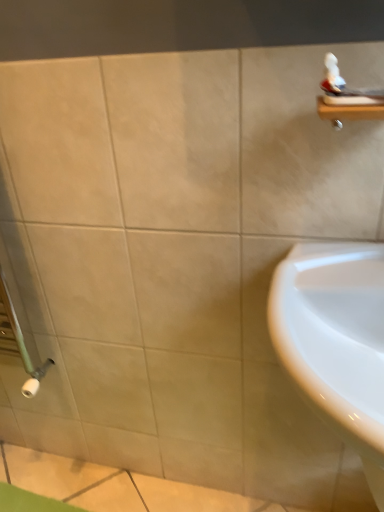
Describe the element at coordinates (348, 112) in the screenshot. The image size is (384, 512). I see `wooden shelf at upper right` at that location.

Identify the location of wooden shelf at upper right. This screenshot has height=512, width=384. (348, 112).

The height and width of the screenshot is (512, 384). Describe the element at coordinates (336, 338) in the screenshot. I see `white glossy sink at lower right` at that location.

What is the approximate width of white glossy sink at lower right?

The width of white glossy sink at lower right is 19.23 inches.

What is the approximate height of white glossy sink at lower right?

white glossy sink at lower right is 19.96 inches tall.

This screenshot has height=512, width=384. Find the location of `white glossy sink at lower right`. white glossy sink at lower right is located at coordinates (336, 338).

The image size is (384, 512). Identify the location of wooden shelf at upper right. (348, 112).

Can you confirm if white glossy sink at lower right is positioned to the left of wooden shelf at upper right?

Yes.

Which is behind, white glossy sink at lower right or wooden shelf at upper right?

Positioned behind is wooden shelf at upper right.

Does point (369, 476) appear closer or farther from the camera than point (333, 114)?

Clearly, point (369, 476) is closer to the camera than point (333, 114).

From the image's perspective, does white glossy sink at lower right appear higher than wooden shelf at upper right?

No, from the image's perspective, white glossy sink at lower right is not above wooden shelf at upper right.

From a real-world perspective, between white glossy sink at lower right and wooden shelf at upper right, who is vertically lower?

From a 3D spatial view, white glossy sink at lower right is below.

Between white glossy sink at lower right and wooden shelf at upper right, which one has larger width?

white glossy sink at lower right.

Considering the sizes of objects white glossy sink at lower right and wooden shelf at upper right in the image provided, who is shorter, white glossy sink at lower right or wooden shelf at upper right?

wooden shelf at upper right.

In the scene shown: Considering the sizes of objects white glossy sink at lower right and wooden shelf at upper right in the image provided, who is bigger, white glossy sink at lower right or wooden shelf at upper right?

Bigger between the two is white glossy sink at lower right.

Is white glossy sink at lower right situated inside wooden shelf at upper right or outside?

white glossy sink at lower right lies outside wooden shelf at upper right.

Can you see white glossy sink at lower right touching wooden shelf at upper right?

No.

Is white glossy sink at lower right oriented towards wooden shelf at upper right?

No, white glossy sink at lower right is not aimed at wooden shelf at upper right.

What's the angular difference between white glossy sink at lower right and wooden shelf at upper right's facing directions?

The facing directions of white glossy sink at lower right and wooden shelf at upper right are 0.323 degrees apart.

Measure the distance between white glossy sink at lower right and wooden shelf at upper right.

white glossy sink at lower right is 13.50 inches away from wooden shelf at upper right.

Find the location of `balustrade that is on the right side of white glossy sink at lower right`. balustrade that is on the right side of white glossy sink at lower right is located at coordinates (348, 112).

In the scene shown: Which object is positioned more to the left, wooden shelf at upper right or white glossy sink at lower right?

white glossy sink at lower right is more to the left.

Is wooden shelf at upper right positioned in front of white glossy sink at lower right?

No, wooden shelf at upper right is further to the viewer.

Between point (340, 105) and point (339, 404), which one is positioned behind?

The point (340, 105) is behind.

From the image's perspective, which is above, wooden shelf at upper right or white glossy sink at lower right?

wooden shelf at upper right, from the image's perspective.

From a real-world perspective, is wooden shelf at upper right on white glossy sink at lower right?

Correct, in the physical world, wooden shelf at upper right is higher than white glossy sink at lower right.

Between wooden shelf at upper right and white glossy sink at lower right, which one has larger width?

With larger width is white glossy sink at lower right.

Is wooden shelf at upper right shorter than white glossy sink at lower right?

Indeed, wooden shelf at upper right has a lesser height compared to white glossy sink at lower right.

Does wooden shelf at upper right have a smaller size compared to white glossy sink at lower right?

Yes, wooden shelf at upper right is smaller than white glossy sink at lower right.

Choose the correct answer: Is wooden shelf at upper right inside white glossy sink at lower right or outside it?

The correct answer is: outside.

Is wooden shelf at upper right beside white glossy sink at lower right?

No, wooden shelf at upper right is not touching white glossy sink at lower right.

Is wooden shelf at upper right oriented away from white glossy sink at lower right?

No, wooden shelf at upper right's orientation is not away from white glossy sink at lower right.

How distant is wooden shelf at upper right from white glossy sink at lower right?

They are 34.30 centimeters apart.

This screenshot has width=384, height=512. I want to click on balustrade positioned vertically above the white glossy sink at lower right (from a real-world perspective), so click(x=348, y=112).

Locate an element on the screen. sink that appears below the wooden shelf at upper right (from the image's perspective) is located at coordinates (336, 338).

Find the location of `balustrade above the white glossy sink at lower right (from a real-world perspective)`. balustrade above the white glossy sink at lower right (from a real-world perspective) is located at coordinates (348, 112).